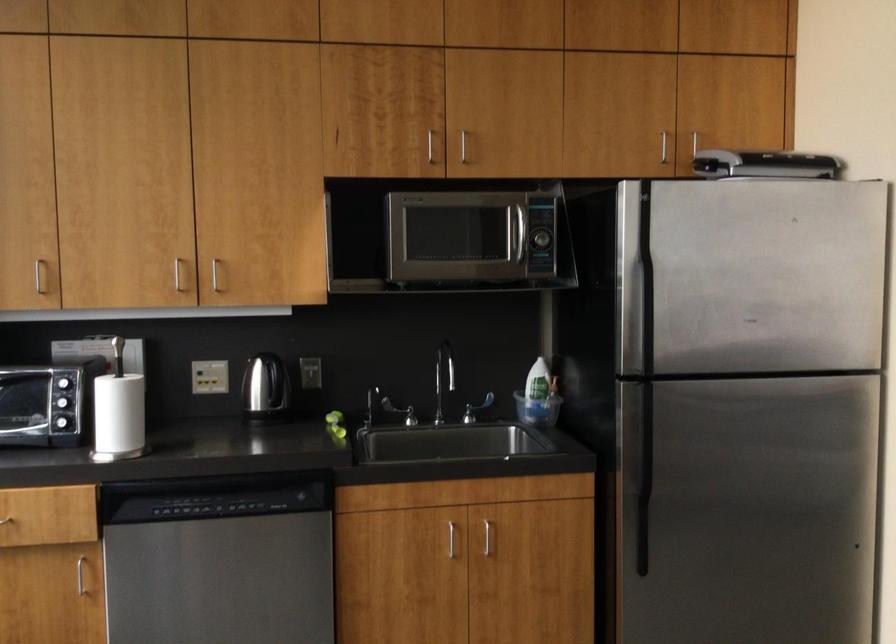
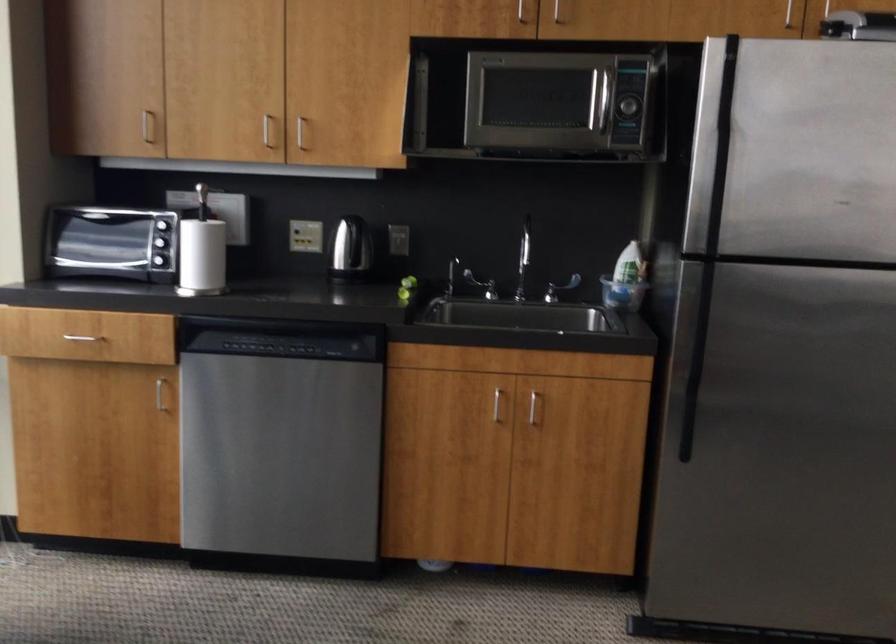
Where in the second image is the point corresponding to (176,277) from the first image?

(266, 129)